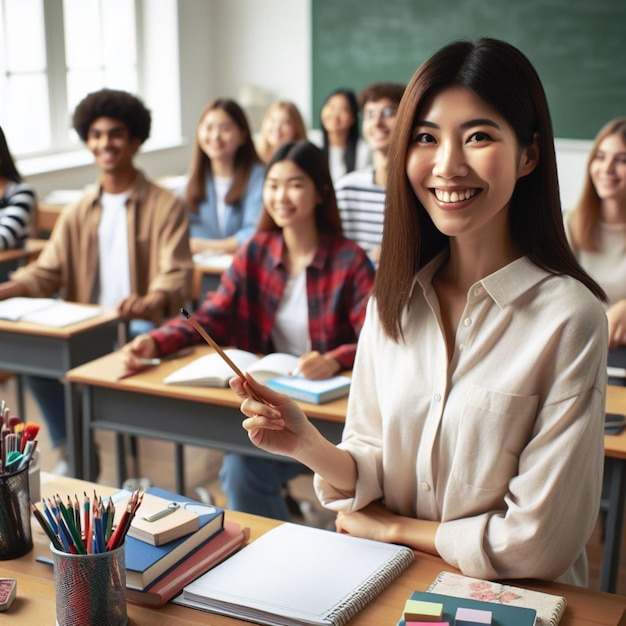
Generate point markers for all yellow post its in the image. Your answer should be formatted as a list of tuples, i.e. [(x1, y1), (x2, y2), ...], where each tuple contains the x and y coordinates of a point satisfying the conditions above.

[(428, 608)]